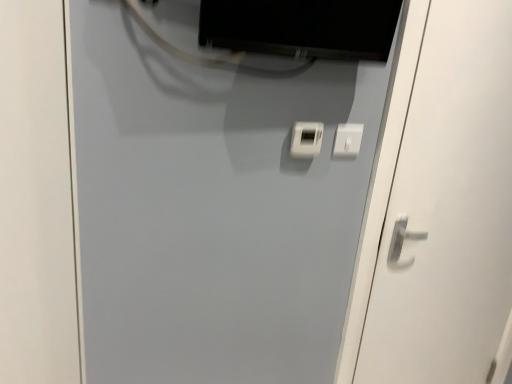
Question: Does matte black monitor at upper center have a greater width compared to white plastic light switch at center?

Choices:
 (A) no
 (B) yes

Answer: (B)

Question: From a real-world perspective, is matte black monitor at upper center over white plastic light switch at center?

Choices:
 (A) no
 (B) yes

Answer: (B)

Question: From the image's perspective, would you say matte black monitor at upper center is shown under white plastic light switch at center?

Choices:
 (A) no
 (B) yes

Answer: (A)

Question: Are matte black monitor at upper center and white plastic light switch at center beside each other?

Choices:
 (A) yes
 (B) no

Answer: (B)

Question: Is matte black monitor at upper center behind white plastic light switch at center?

Choices:
 (A) no
 (B) yes

Answer: (A)

Question: Considering the positions of point (348, 34) and point (455, 271), is point (348, 34) closer or farther from the camera than point (455, 271)?

Choices:
 (A) farther
 (B) closer

Answer: (B)

Question: In terms of width, does matte black monitor at upper center look wider or thinner when compared to white glossy door handle at right, acting as the 1th door starting from the right?

Choices:
 (A) thin
 (B) wide

Answer: (B)

Question: In terms of size, does matte black monitor at upper center appear bigger or smaller than white glossy door handle at right, which is the 2th door in left-to-right order?

Choices:
 (A) big
 (B) small

Answer: (B)

Question: From a real-world perspective, is matte black monitor at upper center physically located above or below white glossy door handle at right, which is the 2th door in left-to-right order?

Choices:
 (A) above
 (B) below

Answer: (A)

Question: Is white glossy door handle at right, acting as the 1th door starting from the right, inside the boundaries of white matte door at center, placed as the first door when sorted from left to right, or outside?

Choices:
 (A) inside
 (B) outside

Answer: (B)

Question: In terms of width, does white glossy door handle at right, which is the 2th door in left-to-right order, look wider or thinner when compared to white matte door at center, acting as the second door starting from the right?

Choices:
 (A) thin
 (B) wide

Answer: (B)

Question: Is white glossy door handle at right, acting as the 1th door starting from the right, in front of or behind white matte door at center, acting as the second door starting from the right, in the image?

Choices:
 (A) front
 (B) behind

Answer: (B)

Question: From the image's perspective, is white glossy door handle at right, acting as the 1th door starting from the right, located above or below white matte door at center, acting as the second door starting from the right?

Choices:
 (A) below
 (B) above

Answer: (A)

Question: In the image, is matte black monitor at upper center positioned in front of or behind white plastic light switch at center?

Choices:
 (A) front
 (B) behind

Answer: (A)

Question: Is matte black monitor at upper center taller or shorter than white plastic light switch at center?

Choices:
 (A) short
 (B) tall

Answer: (B)